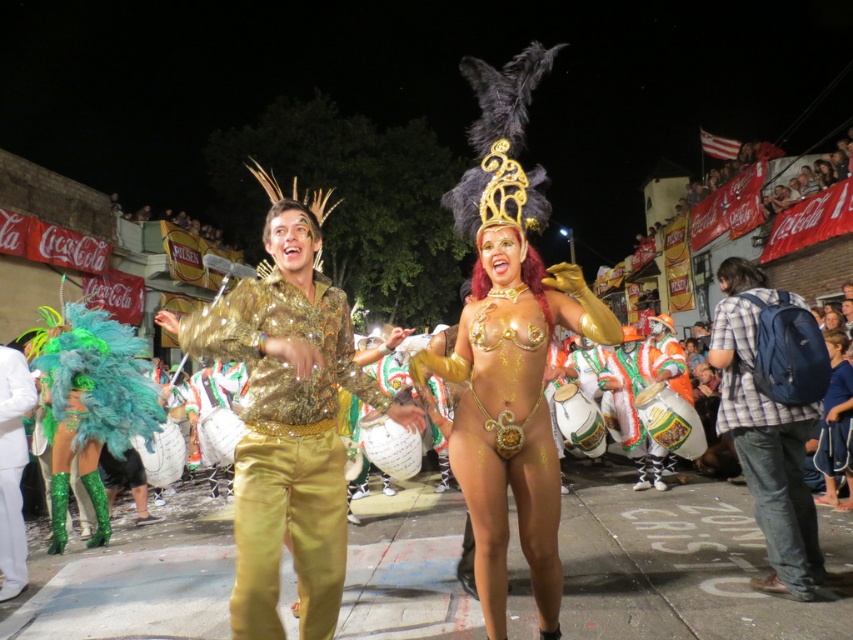
Question: Can you confirm if gold metallic bikini at center is bigger than blue fabric backpack at right?

Choices:
 (A) no
 (B) yes

Answer: (B)

Question: Estimate the real-world distances between objects in this image. Which object is farther from the blue fabric pants at lower right?

Choices:
 (A) gold metallic bikini at center
 (B) blue fabric backpack at right
 (C) gold sequined shirt at center

Answer: (C)

Question: Is gold sequined shirt at center below blue fabric pants at lower right?

Choices:
 (A) no
 (B) yes

Answer: (A)

Question: Which object is closer to the camera taking this photo?

Choices:
 (A) blue fabric pants at lower right
 (B) gold metallic bikini at center

Answer: (B)

Question: Which of these objects is positioned closest to the blue fabric pants at lower right?

Choices:
 (A) gold metallic bikini at center
 (B) blue fabric backpack at right

Answer: (B)

Question: Does blue fabric backpack at right lie behind green feather boa at left?

Choices:
 (A) no
 (B) yes

Answer: (A)